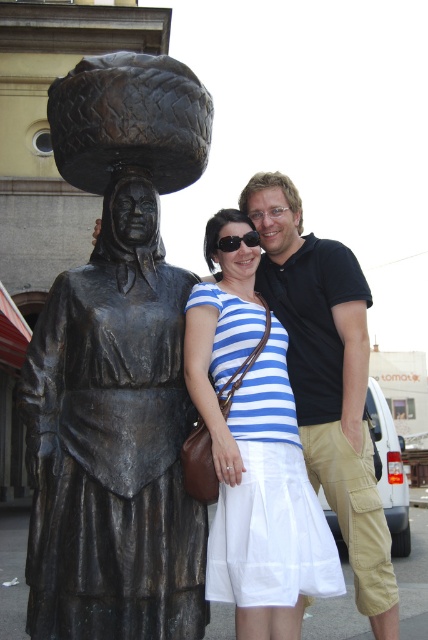
You are a photographer trying to frame a shot that includes both the blue striped dress at center and the black cotton polo shirt at upper right. Which of these two items should you focus on first if you want to ensure both are in the frame?

The blue striped dress at center is not as tall as the black cotton polo shirt at upper right, so you should focus on the black cotton polo shirt at upper right first to ensure both are in the frame.

You are a photographer trying to capture a photo of the bronze statue at left and the black cotton polo shirt at upper right. Which object is positioned closer to the camera?

The bronze statue at left is closer to the viewer than the black cotton polo shirt at upper right, so it is positioned closer to the camera.